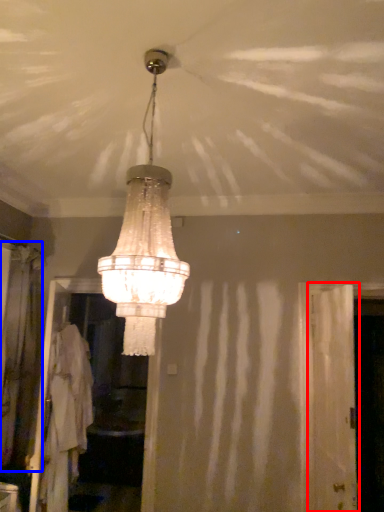
Question: Which of the following is the closest to the observer, screen door (highlighted by a red box) or curtain (highlighted by a blue box)?

Choices:
 (A) screen door
 (B) curtain

Answer: (A)